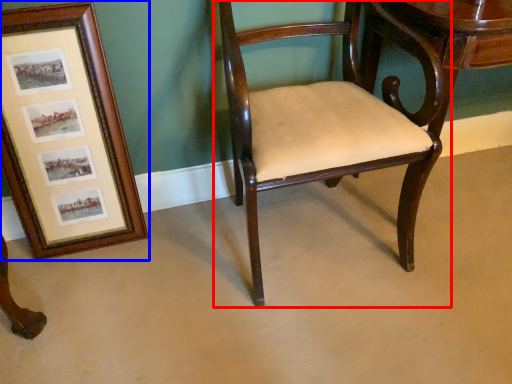
Question: Which of the following is the farthest to the observer, chair (highlighted by a red box) or picture frame (highlighted by a blue box)?

Choices:
 (A) chair
 (B) picture frame

Answer: (B)